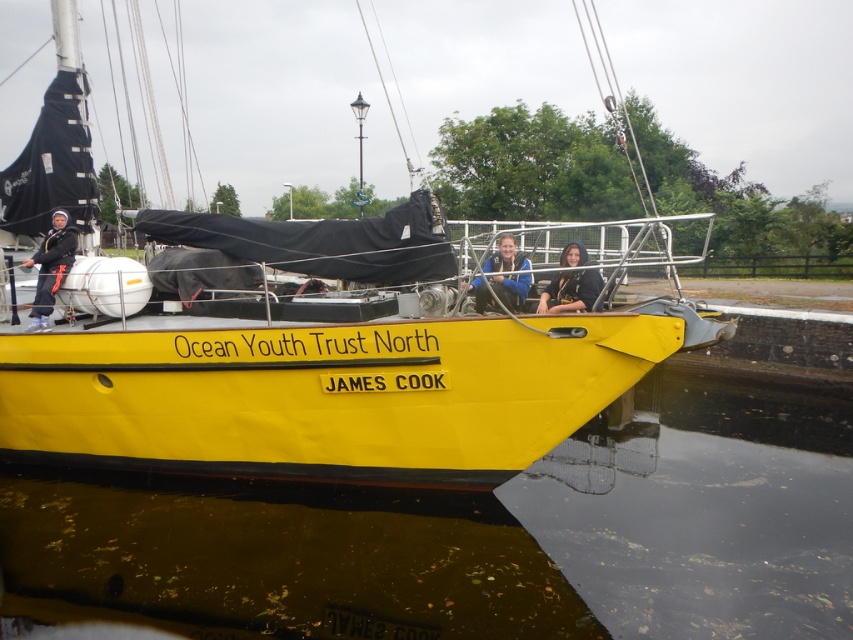
You are a safety inspector checking the distance between the matte black jacket at left and the blue fabric jacket at center on the deck of the Ocean Youth Trust North sailboat. According to regulations, crew members must be at least 3 meters apart for safety. Is the current distance compliant?

The matte black jacket at left is 3.50 meters from the blue fabric jacket at center. Since 3.50 meters meets the minimum requirement of 3 meters, the current distance is compliant with safety regulations.

You are standing on the dock next to the Ocean Youth Trust North sailboat. You need to locate the matte black jacket at left. Where exactly is it positioned on the boat?

The matte black jacket at left is positioned at point 0.419 on the x axis and 0.061 on the y axis.

You are an observer standing on the dock looking at the yellow matte boat at center and the transparent water at lower center. Which object is taller?

The yellow matte boat at center is taller than the transparent water at lower center.